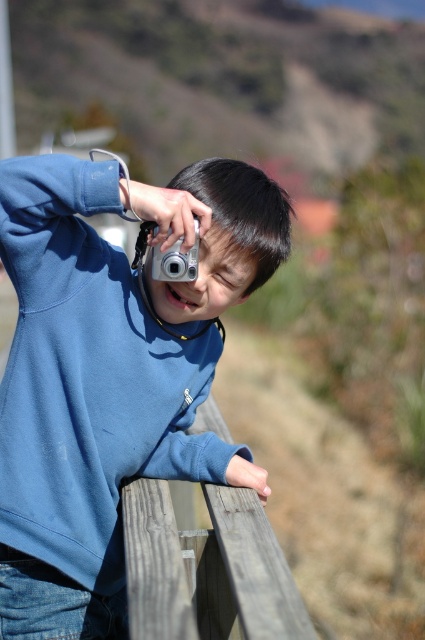
Question: In this image, where is weathered wood fence at lower center located relative to silver metallic camera at upper center?

Choices:
 (A) left
 (B) right

Answer: (B)

Question: Is blue matte sweatshirt at center to the left of silver metallic camera at upper center from the viewer's perspective?

Choices:
 (A) yes
 (B) no

Answer: (A)

Question: Does blue matte sweatshirt at center appear over silver metallic camera at upper center?

Choices:
 (A) yes
 (B) no

Answer: (B)

Question: Which object is farther from the camera taking this photo?

Choices:
 (A) weathered wood fence at lower center
 (B) silver metallic camera at upper center

Answer: (B)

Question: Which point is closer to the camera taking this photo?

Choices:
 (A) (149, 579)
 (B) (181, 312)
 (C) (164, 268)

Answer: (A)

Question: Which is farther from the blue matte sweatshirt at center?

Choices:
 (A) silver metallic camera at upper center
 (B) weathered wood fence at lower center

Answer: (B)